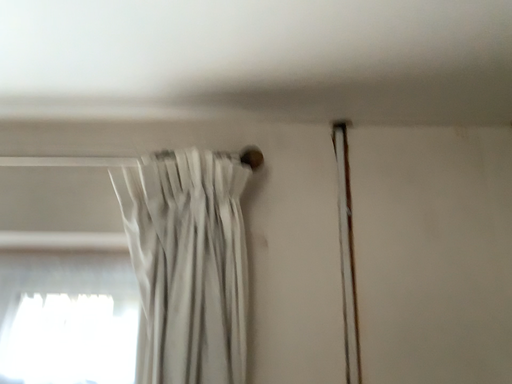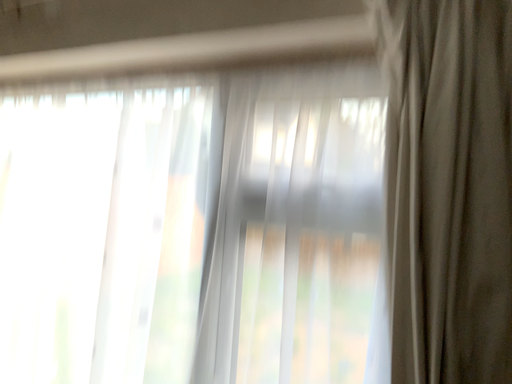
Question: How did the camera likely rotate when shooting the video?

Choices:
 (A) rotated right
 (B) rotated left

Answer: (B)